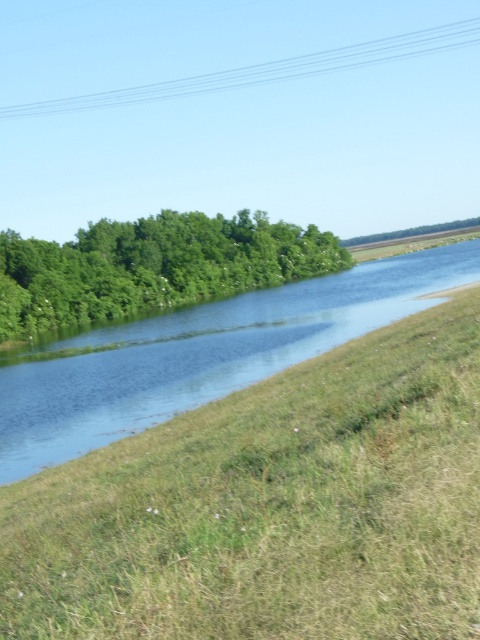
You are standing at the origin point in the image, which is the bottom left corner. The image has a coordinate system where the x and y axes increase to the right and up, respectively. You want to place a small boat exactly at the center of the blue smooth water at center. What are the coordinates where you should place the boat?

The coordinates for the center of the blue smooth water at center are at point [200,355].

You are a kayaker planning to navigate the blue smooth water at center. You want to reach the green leafy trees at center. Based on the distance provided, what is the minimum length your kayak should be to ensure it can safely traverse the distance without touching the bottom?

The minimum length of the kayak should be at least 101.16 feet to safely traverse the distance between the blue smooth water at center and the green leafy trees at center without touching the bottom.